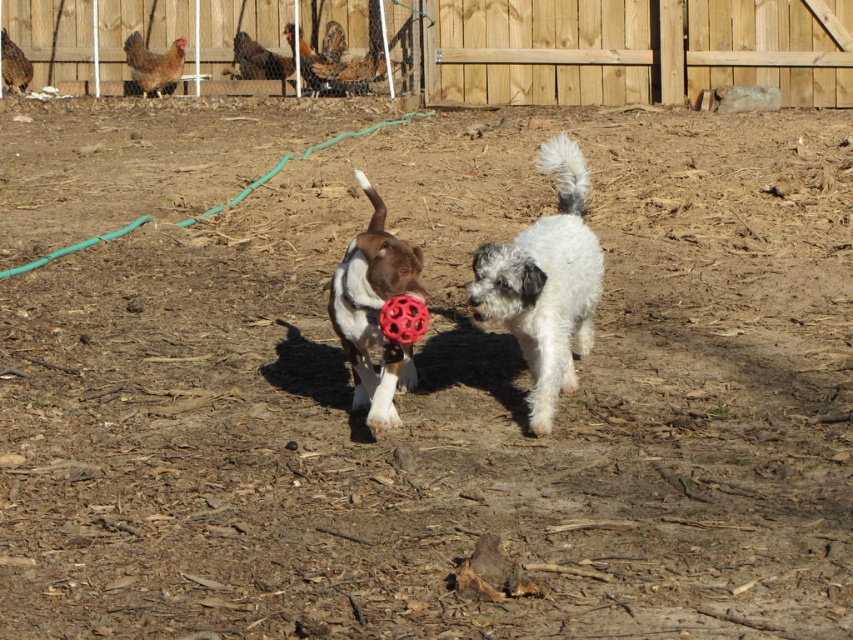
Is point (421, 58) positioned after point (392, 269)?

Yes, it is behind point (392, 269).

Is wooden fence at upper center above brown and white fur at center?

Indeed, wooden fence at upper center is positioned over brown and white fur at center.

Describe the element at coordinates (618, 49) in the screenshot. The width and height of the screenshot is (853, 640). I see `wooden fence at upper center` at that location.

This screenshot has width=853, height=640. Identify the location of wooden fence at upper center. (618, 49).

This screenshot has height=640, width=853. What do you see at coordinates (374, 310) in the screenshot?
I see `brown and white fur at center` at bounding box center [374, 310].

Does brown and white fur at center have a greater height compared to red rubber ball at center?

Yes.

Between point (364, 252) and point (386, 305), which one is positioned behind?

Point (364, 252)

Image resolution: width=853 pixels, height=640 pixels. What are the coordinates of `brown and white fur at center` in the screenshot? It's located at (374, 310).

Does wooden fence at upper center have a larger size compared to red rubber ball at center?

Yes, wooden fence at upper center is bigger than red rubber ball at center.

Who is taller, wooden fence at upper center or red rubber ball at center?

Standing taller between the two is wooden fence at upper center.

Locate an element on the screen. The width and height of the screenshot is (853, 640). wooden fence at upper center is located at coordinates (618, 49).

Find the location of a particular element. wooden fence at upper center is located at coordinates (618, 49).